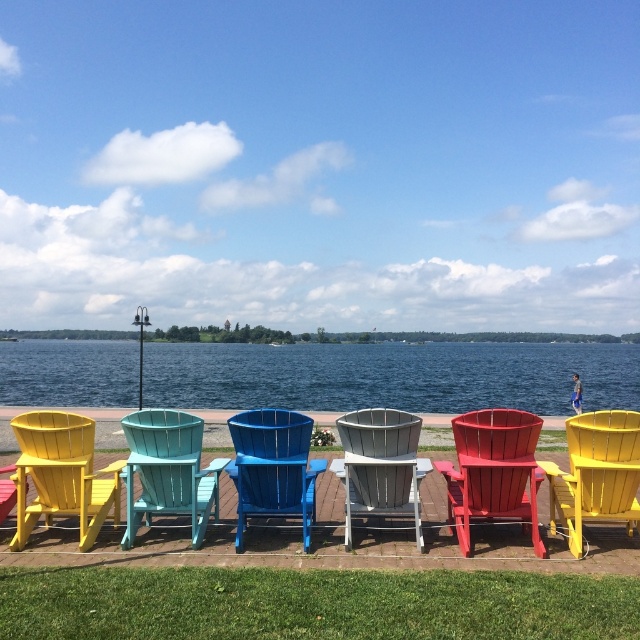
Does blue water at center appear on the right side of teal wood beach chair at center?

Correct, you'll find blue water at center to the right of teal wood beach chair at center.

Measure the distance from blue water at center to teal wood beach chair at center.

blue water at center is 100.71 meters from teal wood beach chair at center.

Measure the distance between blue water at center and camera.

The distance of blue water at center from camera is 140.04 feet.

Find the location of a particular element. This screenshot has height=640, width=640. blue water at center is located at coordinates (390, 376).

Can you confirm if matte yellow beach chair at left is positioned below white wood beach chair at center?

Correct, matte yellow beach chair at left is located below white wood beach chair at center.

Who is taller, matte yellow beach chair at left or white wood beach chair at center?

Standing taller between the two is matte yellow beach chair at left.

Locate an element on the screen. matte yellow beach chair at left is located at coordinates (61, 474).

Does teal wood beach chair at center appear on the right side of white wood beach chair at center?

In fact, teal wood beach chair at center is to the left of white wood beach chair at center.

Consider the image. Is teal wood beach chair at center further to camera compared to white wood beach chair at center?

Yes, teal wood beach chair at center is further from the viewer.

Which is behind, point (154, 422) or point (365, 513)?

Point (365, 513)

Find the location of a particular element. teal wood beach chair at center is located at coordinates (168, 470).